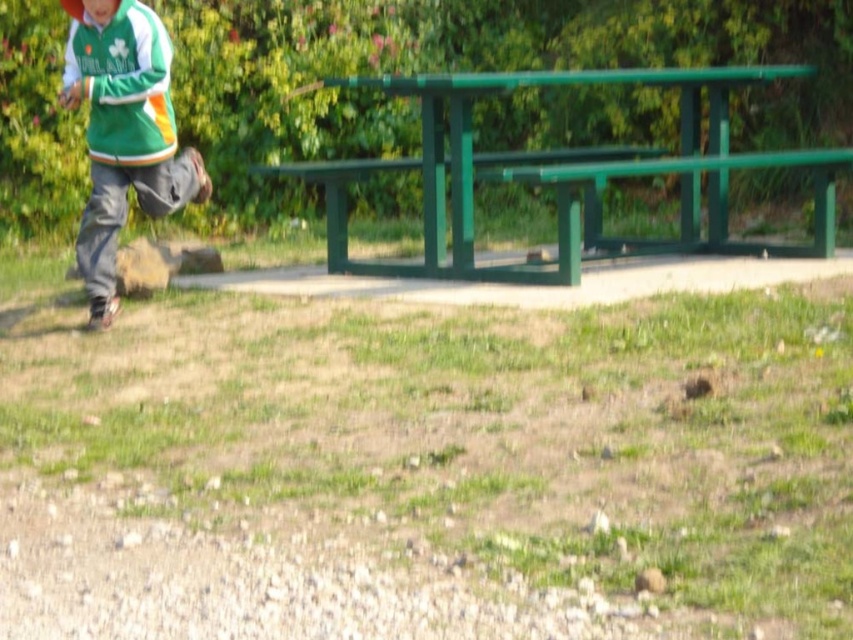
Question: Is green painted wood bench at center positioned at the back of green fleece jacket at left?

Choices:
 (A) no
 (B) yes

Answer: (A)

Question: Which point appears closest to the camera in this image?

Choices:
 (A) pyautogui.click(x=425, y=225)
 (B) pyautogui.click(x=160, y=176)
 (C) pyautogui.click(x=76, y=3)

Answer: (C)

Question: Which of the following is the closest to the observer?

Choices:
 (A) green matte baseball cap at upper left
 (B) green painted wood bench at center
 (C) green fleece jacket at left

Answer: (B)

Question: Is green painted wood bench at center to the right of green matte baseball cap at upper left from the viewer's perspective?

Choices:
 (A) no
 (B) yes

Answer: (B)

Question: Estimate the real-world distances between objects in this image. Which object is closer to the green matte baseball cap at upper left?

Choices:
 (A) green fleece jacket at left
 (B) green painted wood bench at center

Answer: (A)

Question: Does green painted wood bench at center have a lesser width compared to green matte baseball cap at upper left?

Choices:
 (A) yes
 (B) no

Answer: (B)